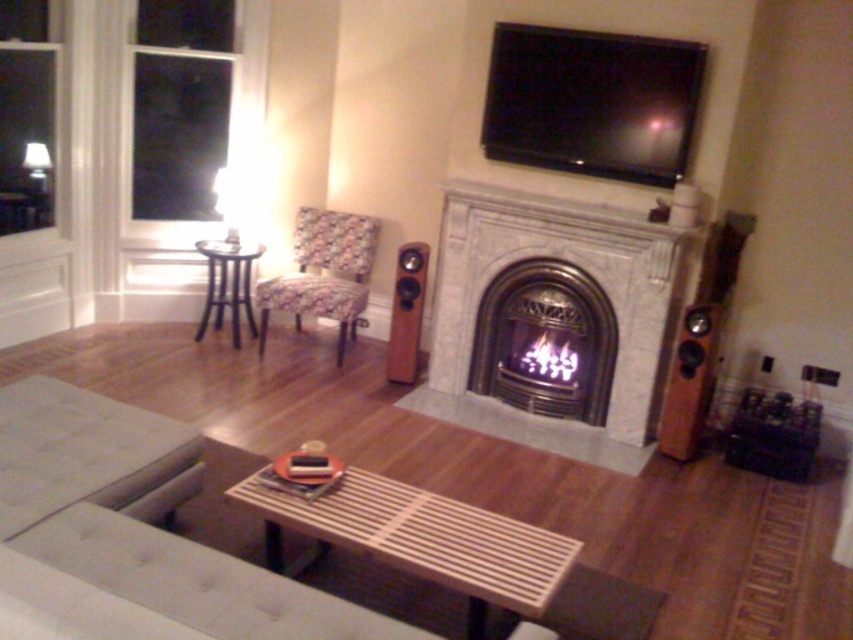
You are standing in the living room and want to place a new rug. The ottoman is at point (80, 451). Where should you place the rug relative to the ottoman to ensure it is centered under the ottoman?

The ottoman is already at point (80, 451), so placing the rug directly under this point would center it beneath the white fabric ottoman at lower left.

You are arranging a party in the living room and need to move the floral fabric chair at center and the wooden speaker at center closer to the entrance door, which is on the right side of the room. Which object should you move first to get them closer to the door?

The wooden speaker at center is closer to the entrance door on the right side since the floral fabric chair at center is to the left of it. Therefore, you should move the floral fabric chair at center first to allow easier access to the wooden speaker at center.

You are a delivery person trying to place a new rug in the living room. The rug needs to be placed directly in front of the white marble fireplace at center and must not cover any part of the wooden speaker at center. Based on the scene description, where should you position the rug?

The white marble fireplace at center is positioned over the wooden speaker at center, so the rug should be placed directly in front of the white marble fireplace at center but below it to avoid covering the wooden speaker at center.